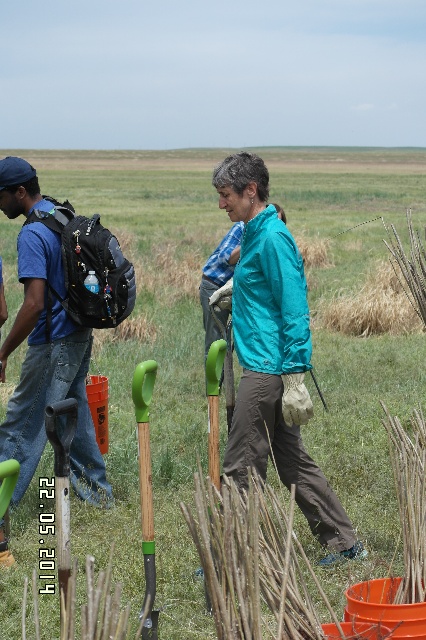
You are a photographer trying to capture a photo of the teal fabric jacket at center and the green wood shovel at center. Based on their sizes, which object should you focus on first if you want to ensure both are fully in frame without moving the camera?

The teal fabric jacket at center is wider than the green wood shovel at center. Therefore, focusing on the teal fabric jacket at center first will ensure both objects fit within the frame since it is the wider object.

You are standing at the origin point of the coordinate system in the image. You want to walk directly to the teal fabric jacket at center. Which direction should you head towards?

The teal fabric jacket at center is located at coordinate point 0.555 on the x axis and 0.643 on the y axis. Since you are at the origin, you should move towards the positive x and positive y directions to reach it.